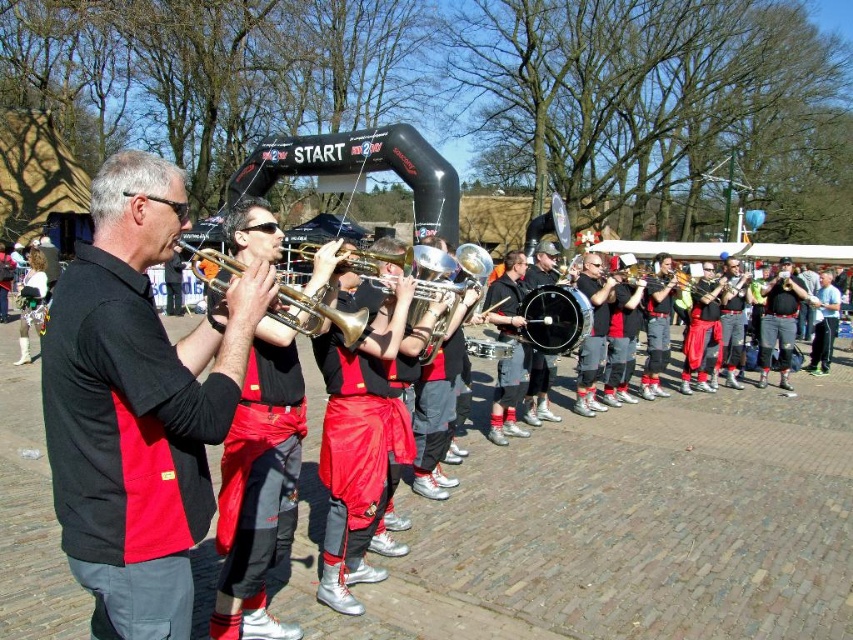
You are a photographer standing at point (x=259, y=486). You want to capture a photo of the matte black trumpet at left. Where should you position yourself to ensure the trumpet is centered in your frame?

The matte black trumpet at left is located at point (x=259, y=486), so positioning yourself directly at that point would center the trumpet in your frame.

You are a photographer trying to capture a photo of the matte black shirt at left and the matte black trumpet at left. Which object should you focus on first if you want to include both in your frame?

The matte black shirt at left is positioned on the left side of the matte black trumpet at left, so you should focus on the matte black shirt at left first to ensure both are in frame.

You are a photographer trying to capture a clear shot of the matte black shirt at left and the gold brass trumpet at center. Since you want to ensure both are visible in your frame, which object should you focus on first to account for their sizes?

The matte black shirt at left has a greater height compared to the gold brass trumpet at center, so you should focus on the matte black shirt at left first as it is larger and might require more attention to detail to fit both in the frame.